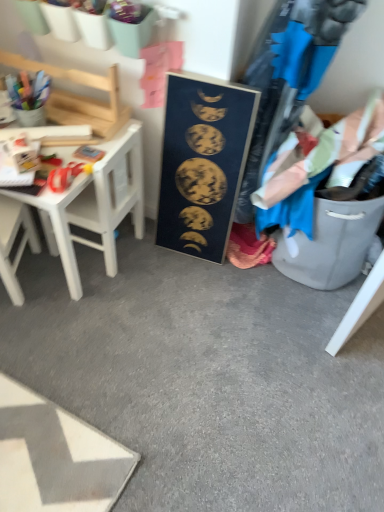
Locate an element on the screen. This screenshot has width=384, height=512. vacant space in front of gold metallic moon phases at center is located at coordinates (186, 288).